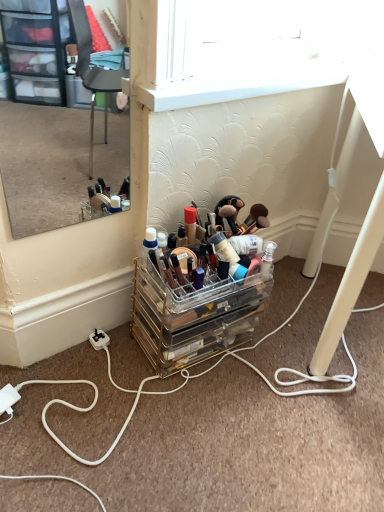
At what (x,y) coordinates should I click in order to perform the action: click on free space to the left of white plastic power outlet at lower left. Please return your answer as a coordinate pair (x, y). Looking at the image, I should click on (49, 358).